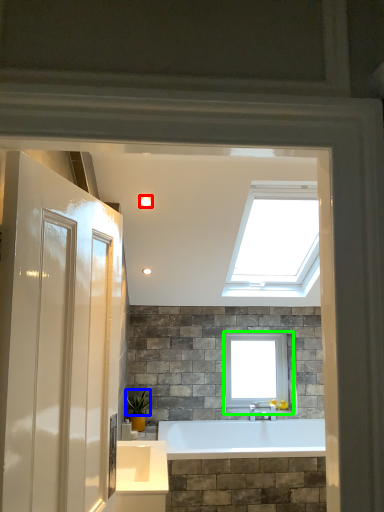
Question: Considering the real-world distances, which object is closest to lighting (highlighted by a red box)? plant (highlighted by a blue box) or window (highlighted by a green box).

Choices:
 (A) plant
 (B) window

Answer: (A)